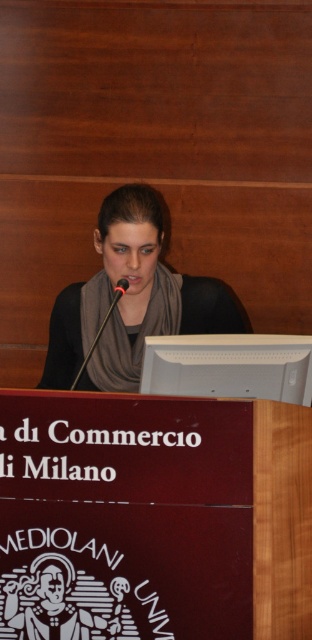
You are an event organizer setting up for a presentation. You have two microphones on the podium. The black plastic microphone at center and the black matte microphone at center. Which one is positioned to the left?

The black plastic microphone at center is to the left of the black matte microphone at center.

What are the coordinates of the black plastic microphone at center?

The black plastic microphone at center is located at coordinates point [102,326].